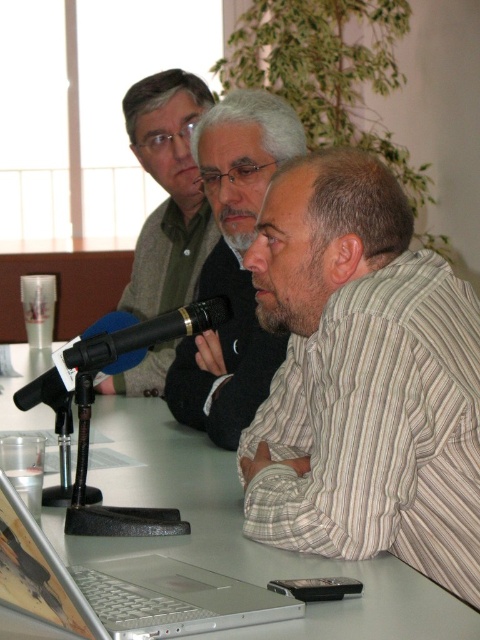
Who is positioned more to the right, striped cotton shirt at center or silver metallic laptop at lower left?

striped cotton shirt at center

Who is higher up, striped cotton shirt at center or silver metallic laptop at lower left?

striped cotton shirt at center is higher up.

Which is in front, point (263, 314) or point (153, 612)?

Positioned in front is point (153, 612).

Find the location of a particular element. The image size is (480, 640). striped cotton shirt at center is located at coordinates (362, 380).

Between matte black jacket at center and black matte microphone at center, which one is positioned higher?

matte black jacket at center is above.

You are a GUI agent. You are given a task and a screenshot of the screen. Output one action in this format:
    pyautogui.click(x=<x>, y=<y>)
    Task: Click on the matte black jacket at center
    
    Given the screenshot: What is the action you would take?
    pyautogui.click(x=232, y=266)

Find the location of `matte black jacket at center`. matte black jacket at center is located at coordinates (232, 266).

The image size is (480, 640). I want to click on matte black jacket at center, so click(232, 266).

This screenshot has height=640, width=480. Describe the element at coordinates (242, 536) in the screenshot. I see `silver metallic table at center` at that location.

Can you confirm if silver metallic table at center is shorter than silver metallic laptop at lower left?

In fact, silver metallic table at center may be taller than silver metallic laptop at lower left.

Which is behind, point (57, 545) or point (72, 586)?

Point (57, 545)

Where is `silver metallic table at center`? silver metallic table at center is located at coordinates (242, 536).